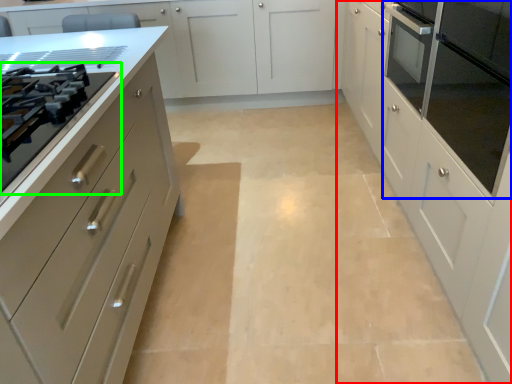
Question: Which is farther away from cabinetry (highlighted by a red box)? home appliance (highlighted by a blue box) or drawer (highlighted by a green box)?

Choices:
 (A) home appliance
 (B) drawer

Answer: (B)